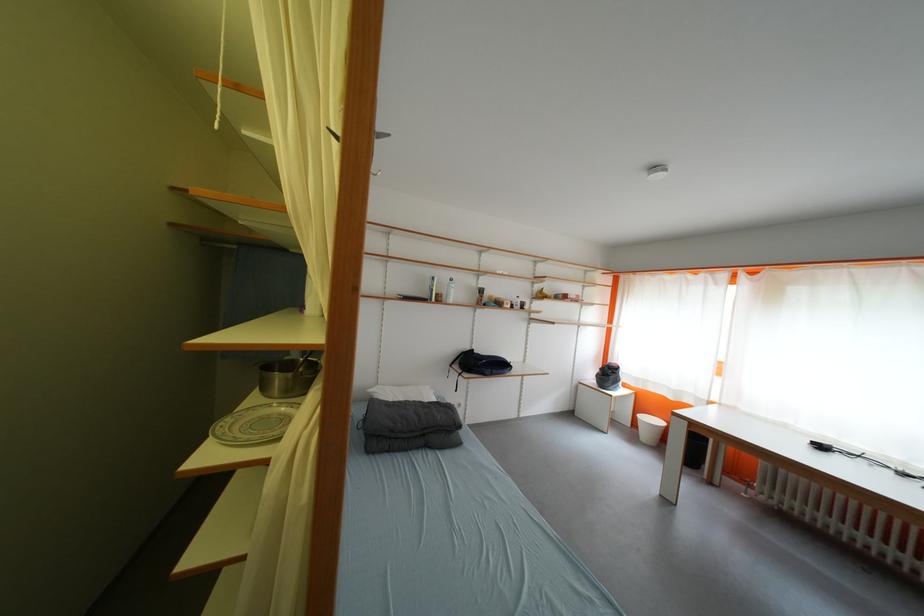
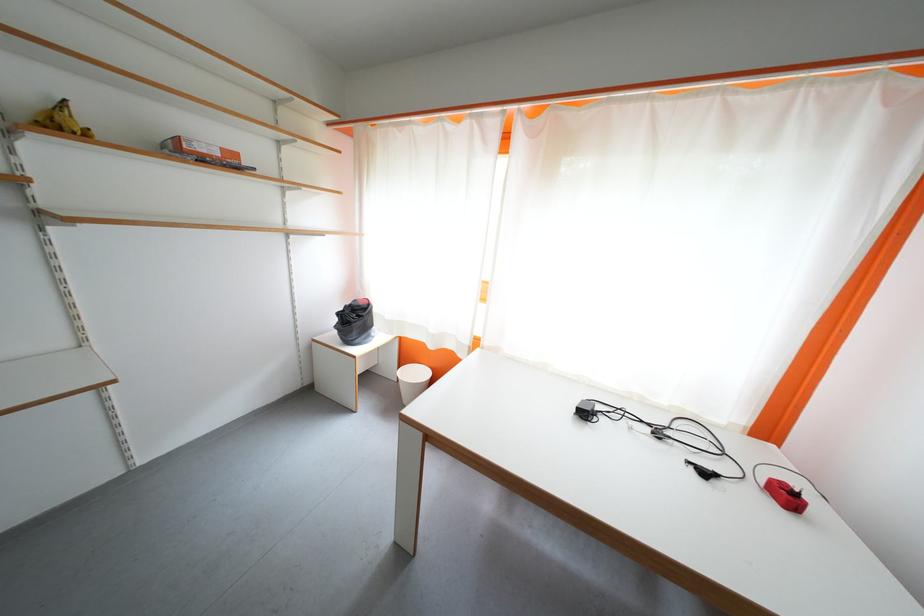
Locate, in the second image, the point that corresponds to pixel 681 402 in the first image.

(440, 350)